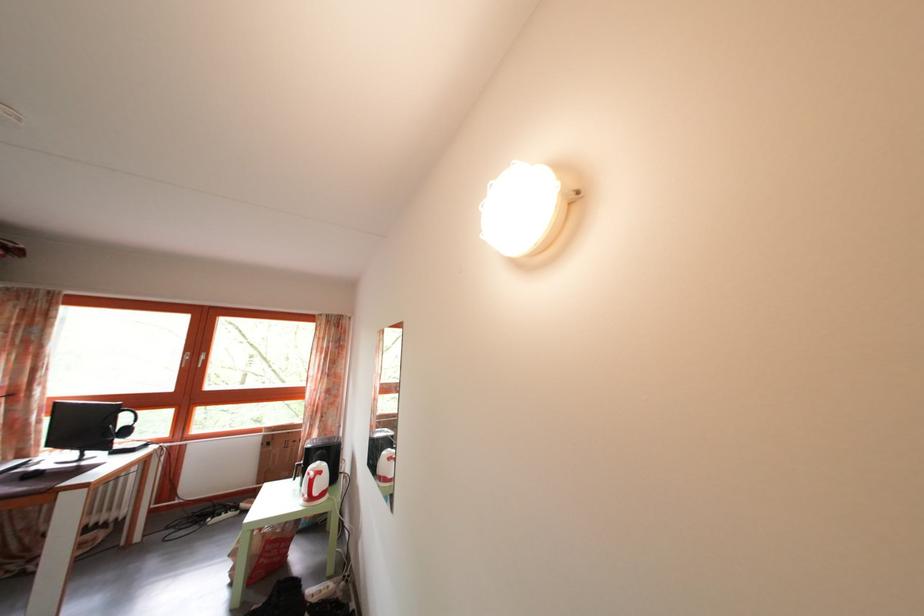
Find where to lift the white kettle handle. Please return your answer as a coordinate pair (x, y).

(314, 483)